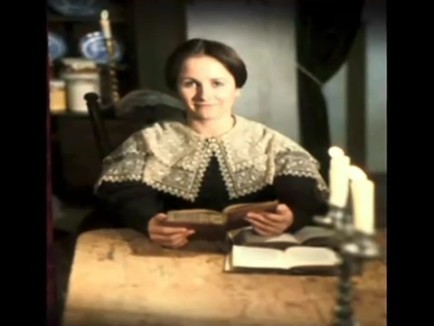
What are the coordinates of `book` in the screenshot? It's located at (222, 221).